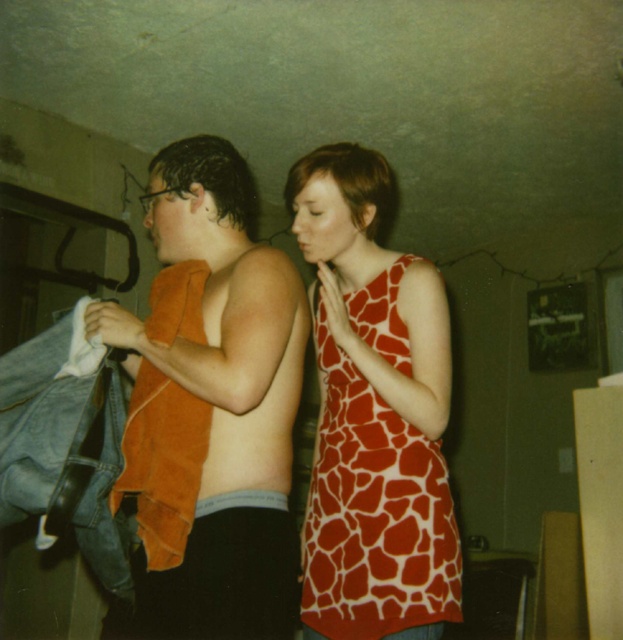
Question: Does orange towel at center have a greater width compared to giraffe print fabric dress at center?

Choices:
 (A) no
 (B) yes

Answer: (B)

Question: Is orange towel at center further to camera compared to giraffe print fabric dress at center?

Choices:
 (A) no
 (B) yes

Answer: (A)

Question: From the image, what is the correct spatial relationship of orange towel at center in relation to giraffe print fabric dress at center?

Choices:
 (A) above
 (B) below

Answer: (A)

Question: Among these objects, which one is farthest from the camera?

Choices:
 (A) orange towel at center
 (B) giraffe print fabric dress at center

Answer: (B)

Question: Which of the following is the closest to the observer?

Choices:
 (A) orange towel at center
 (B) giraffe print fabric dress at center

Answer: (A)